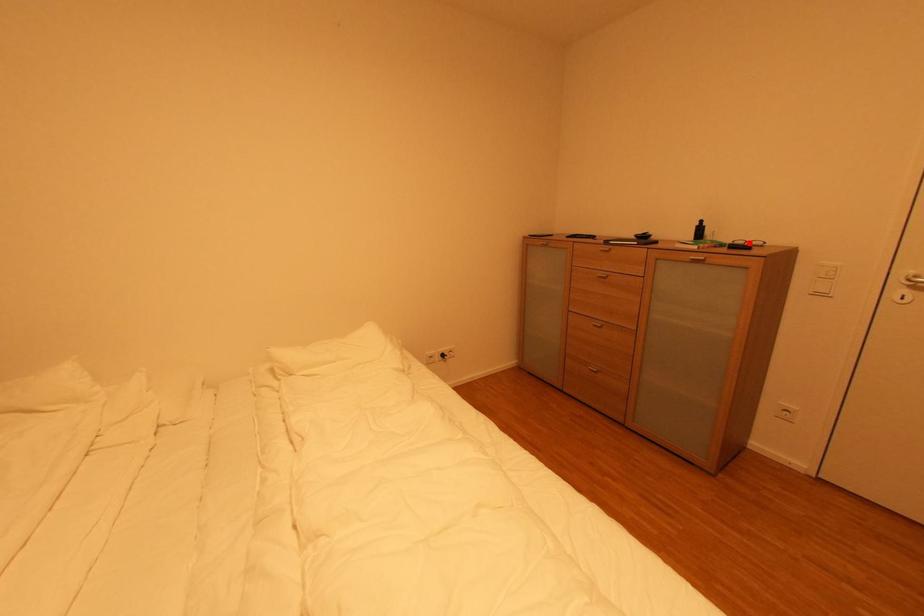
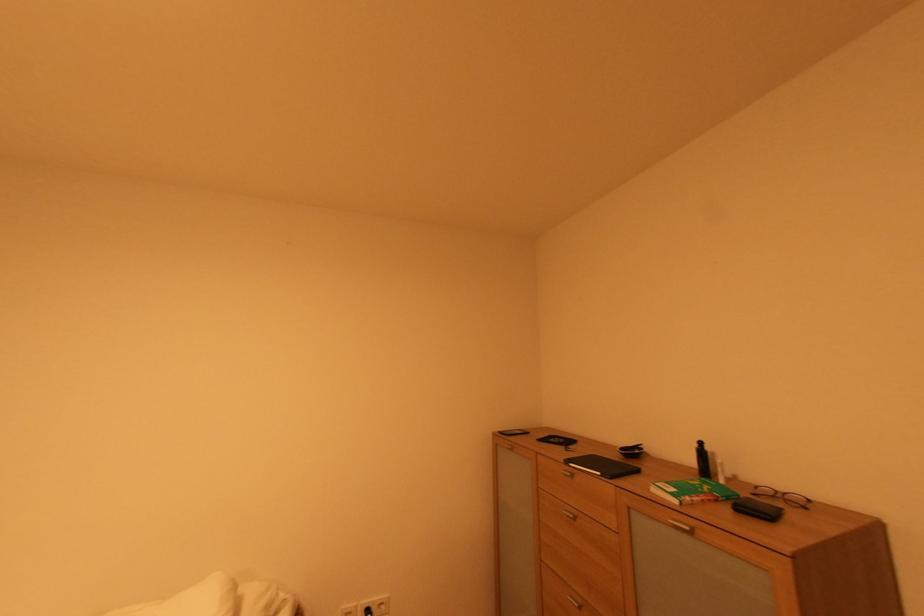
Where in the second image is the point corresponding to the highlighted location from the first image?

(777, 493)